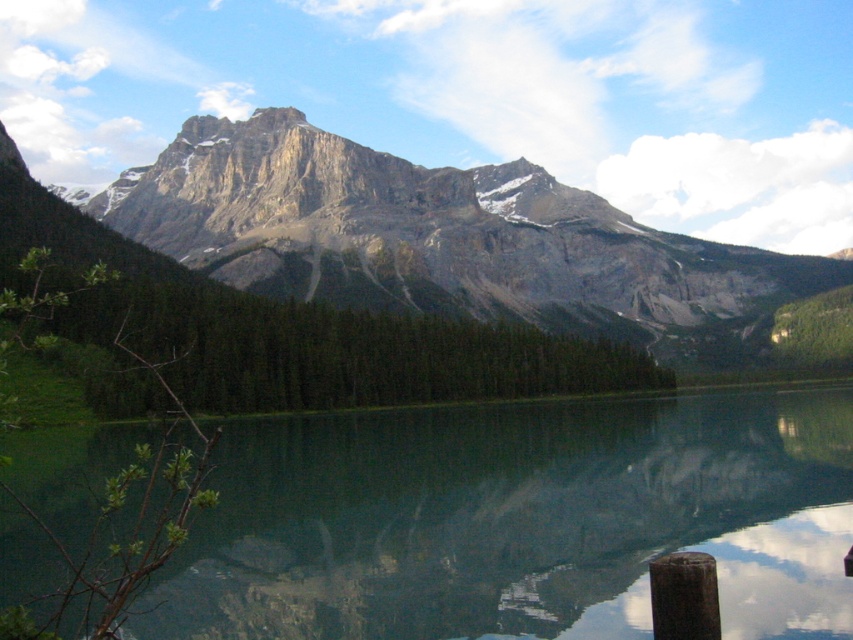
Question: Which object appears closest to the camera in this image?

Choices:
 (A) rocky gray mountain range at upper center
 (B) green glossy water at center

Answer: (B)

Question: Is green glossy water at center above rocky gray mountain range at upper center?

Choices:
 (A) no
 (B) yes

Answer: (A)

Question: Does green glossy water at center appear under rocky gray mountain range at upper center?

Choices:
 (A) yes
 (B) no

Answer: (A)

Question: Can you confirm if green glossy water at center is smaller than rocky gray mountain range at upper center?

Choices:
 (A) no
 (B) yes

Answer: (B)

Question: Which point is farther to the camera?

Choices:
 (A) rocky gray mountain range at upper center
 (B) green glossy water at center

Answer: (A)